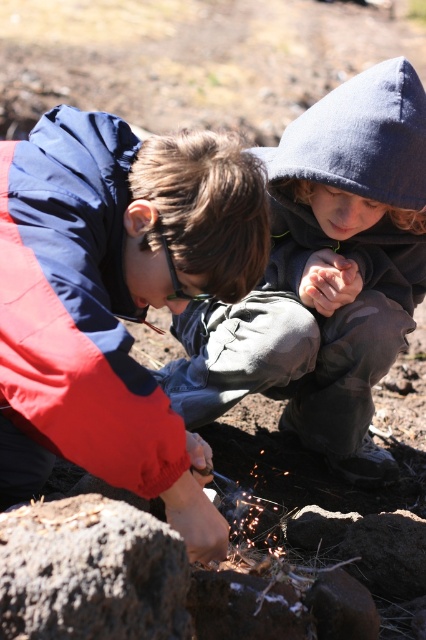
Between brushed metal knife at lower left and rough textured rock at center, which one has more height?

With more height is brushed metal knife at lower left.

Is point (117, 218) positioned behind point (63, 634)?

Yes.

This screenshot has height=640, width=426. In order to click on brushed metal knife at lower left in this screenshot , I will do `click(115, 300)`.

Which is below, rough textured rock at center or smooth gray rock at center?

smooth gray rock at center is lower down.

Is point (100, 561) less distant than point (310, 536)?

Yes, it is.

Locate an element on the screen. The width and height of the screenshot is (426, 640). rough textured rock at center is located at coordinates (91, 572).

Which is more to the left, rough textured rock at center or smooth brown rock at center?

rough textured rock at center is more to the left.

Where is `rough textured rock at center`? rough textured rock at center is located at coordinates (91, 572).

Locate an element on the screen. The width and height of the screenshot is (426, 640). rough textured rock at center is located at coordinates (91, 572).